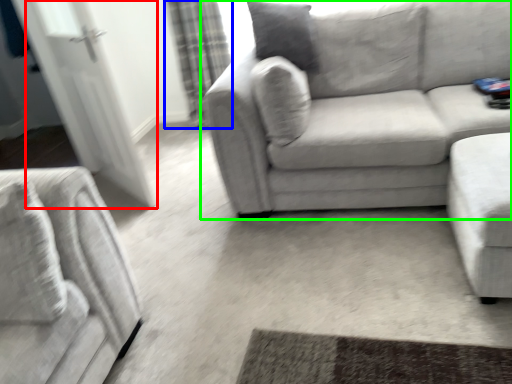
Question: Which object is the closest to the glass door (highlighted by a red box)? Choose among these: curtain (highlighted by a blue box) or studio couch (highlighted by a green box).

Choices:
 (A) curtain
 (B) studio couch

Answer: (A)